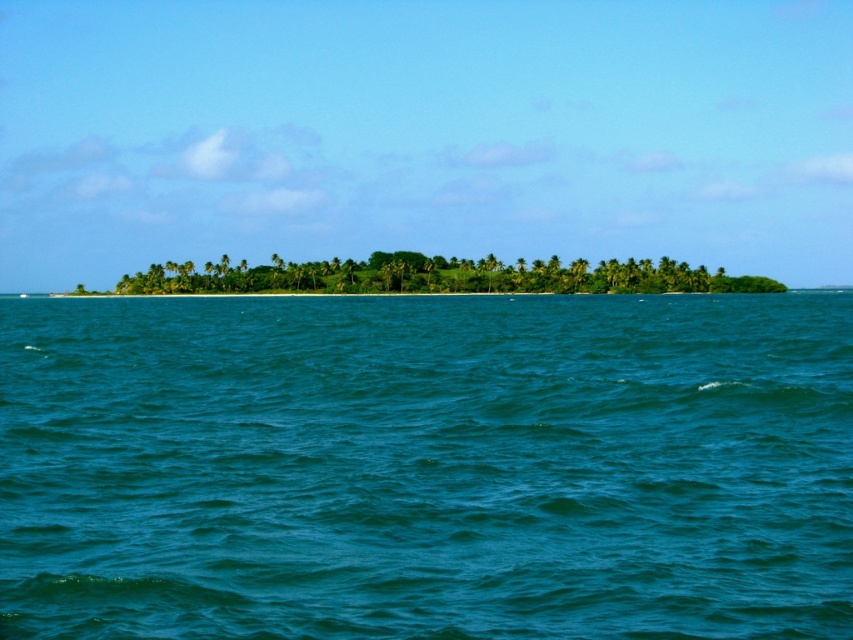
You are a marine biologist studying the water surface in the image. You need to locate the exact coordinates of the teal glossy water at center for your research. What are the coordinates where you can find it?

The teal glossy water at center can be found at coordinates point [426,467].

You are standing on a boat in the middle of the ocean and see the teal glossy water at center and the green leafy island at center. Which object is positioned to the right side from your perspective?

The teal glossy water at center is positioned to the right of the green leafy island at center.

You are a photographer planning to capture the reflection of the green leafy island at center in the teal glossy water at center. Based on the scene, can you confirm if the island is positioned above the water where its reflection would naturally appear?

The teal glossy water at center is below the green leafy island at center, so the reflection of the green leafy island at center would naturally appear on the teal glossy water at center.